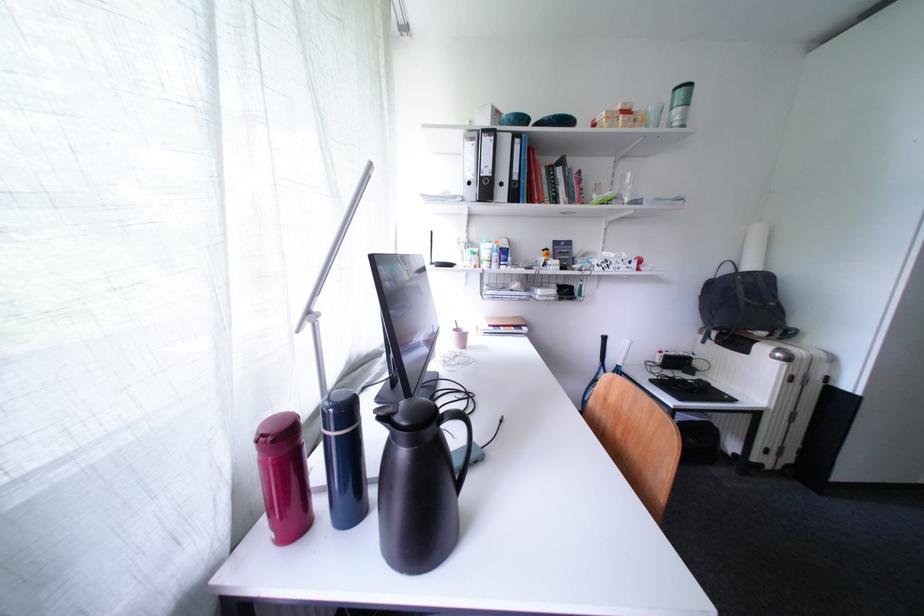
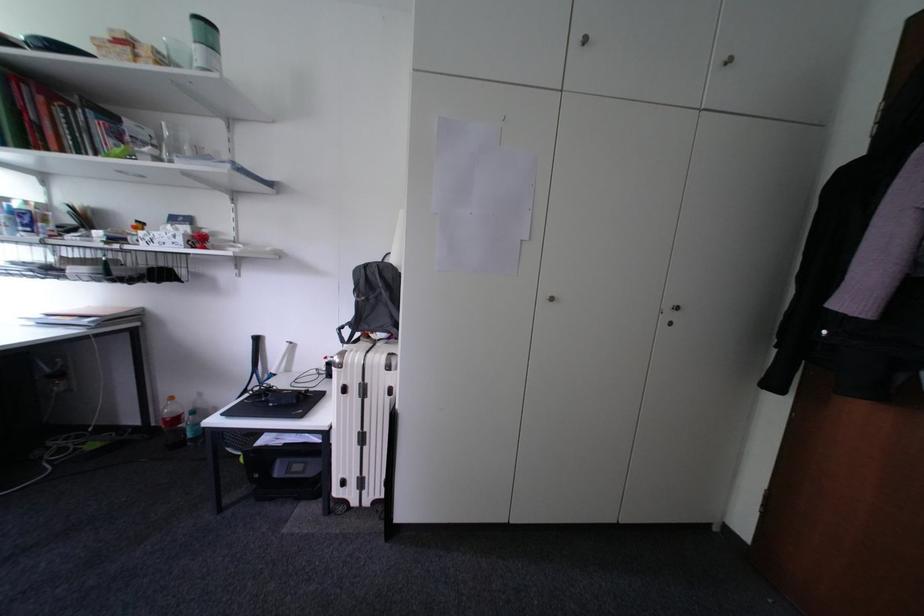
Locate, in the second image, the point that corresponds to (798,382) in the first image.

(353, 392)